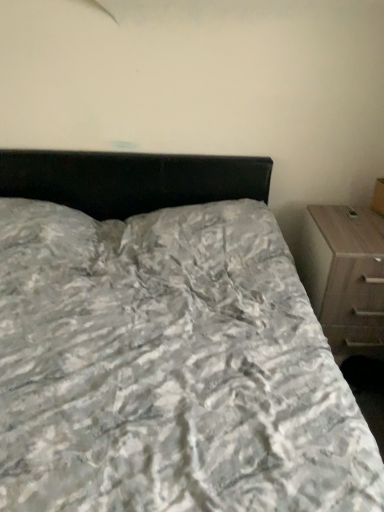
Locate an element on the screen. This screenshot has height=512, width=384. wooden chest of drawers at right is located at coordinates (346, 277).

This screenshot has height=512, width=384. Describe the element at coordinates (346, 277) in the screenshot. I see `wooden chest of drawers at right` at that location.

You are a GUI agent. You are given a task and a screenshot of the screen. Output one action in this format:
    pyautogui.click(x=<x>, y=<y>)
    Task: Click on the textured gray bedspread at center
    The width and height of the screenshot is (384, 512).
    Given the screenshot: What is the action you would take?
    pyautogui.click(x=164, y=345)

Measure the distance between textured gray bedspread at center and camera.

36.14 inches.

The height and width of the screenshot is (512, 384). Describe the element at coordinates (164, 345) in the screenshot. I see `textured gray bedspread at center` at that location.

Locate an element on the screen. wooden chest of drawers at right is located at coordinates (346, 277).

Between textured gray bedspread at center and wooden chest of drawers at right, which one appears on the left side from the viewer's perspective?

Positioned to the left is textured gray bedspread at center.

Between textured gray bedspread at center and wooden chest of drawers at right, which one is positioned behind?

wooden chest of drawers at right is more distant.

Does point (189, 506) come closer to viewer compared to point (352, 255)?

Yes, it is.

From the image's perspective, does textured gray bedspread at center appear lower than wooden chest of drawers at right?

Indeed, from the image's perspective, textured gray bedspread at center is shown beneath wooden chest of drawers at right.

From a real-world perspective, between textured gray bedspread at center and wooden chest of drawers at right, who is vertically higher?

textured gray bedspread at center is physically above.

Which object is wider, textured gray bedspread at center or wooden chest of drawers at right?

With larger width is textured gray bedspread at center.

Is textured gray bedspread at center taller than wooden chest of drawers at right?

Yes, textured gray bedspread at center is taller than wooden chest of drawers at right.

Who is bigger, textured gray bedspread at center or wooden chest of drawers at right?

With larger size is textured gray bedspread at center.

Is wooden chest of drawers at right a part of textured gray bedspread at center?

No, wooden chest of drawers at right is not inside textured gray bedspread at center.

Are textured gray bedspread at center and wooden chest of drawers at right located far from each other?

No, textured gray bedspread at center is not far away from wooden chest of drawers at right.

Is textured gray bedspread at center turned away from wooden chest of drawers at right?

No, textured gray bedspread at center is not facing the opposite direction of wooden chest of drawers at right.

Identify the location of bed above the wooden chest of drawers at right (from a real-world perspective). Image resolution: width=384 pixels, height=512 pixels. (164, 345).

From the picture: Which is more to the left, wooden chest of drawers at right or textured gray bedspread at center?

textured gray bedspread at center is more to the left.

Is wooden chest of drawers at right closer to camera compared to textured gray bedspread at center?

No.

Is point (366, 322) closer or farther from the camera than point (252, 220)?

Point (366, 322) is positioned closer to the camera compared to point (252, 220).

From the image's perspective, which one is positioned lower, wooden chest of drawers at right or textured gray bedspread at center?

textured gray bedspread at center appears lower in the image.

From a real-world perspective, is wooden chest of drawers at right physically located above or below textured gray bedspread at center?

From a real-world perspective, wooden chest of drawers at right is physically below textured gray bedspread at center.

Considering the sizes of objects wooden chest of drawers at right and textured gray bedspread at center in the image provided, who is wider, wooden chest of drawers at right or textured gray bedspread at center?

textured gray bedspread at center.

Can you confirm if wooden chest of drawers at right is taller than textured gray bedspread at center?

In fact, wooden chest of drawers at right may be shorter than textured gray bedspread at center.

Considering the relative sizes of wooden chest of drawers at right and textured gray bedspread at center in the image provided, is wooden chest of drawers at right bigger than textured gray bedspread at center?

No, wooden chest of drawers at right is not bigger than textured gray bedspread at center.

Could textured gray bedspread at center be considered to be inside wooden chest of drawers at right?

No.

Is wooden chest of drawers at right beside textured gray bedspread at center?

There is a gap between wooden chest of drawers at right and textured gray bedspread at center.

Is textured gray bedspread at center at the back of wooden chest of drawers at right?

No, wooden chest of drawers at right's orientation is not away from textured gray bedspread at center.

Can you tell me how much wooden chest of drawers at right and textured gray bedspread at center differ in facing direction?

wooden chest of drawers at right and textured gray bedspread at center are facing 1.09 degrees away from each other.

Measure the distance between wooden chest of drawers at right and textured gray bedspread at center.

They are 63.70 centimeters apart.

There is a wooden chest of drawers at right. At what (x,y) coordinates should I click in order to perform the action: click on bed above it (from a real-world perspective). Please return your answer as a coordinate pair (x, y). Image resolution: width=384 pixels, height=512 pixels. Looking at the image, I should click on (164, 345).

Identify the location of bed below the wooden chest of drawers at right (from the image's perspective). This screenshot has width=384, height=512. (164, 345).

Where is `the chest of drawers that is above the textured gray bedspread at center (from the image's perspective)`? The height and width of the screenshot is (512, 384). the chest of drawers that is above the textured gray bedspread at center (from the image's perspective) is located at coordinates (346, 277).